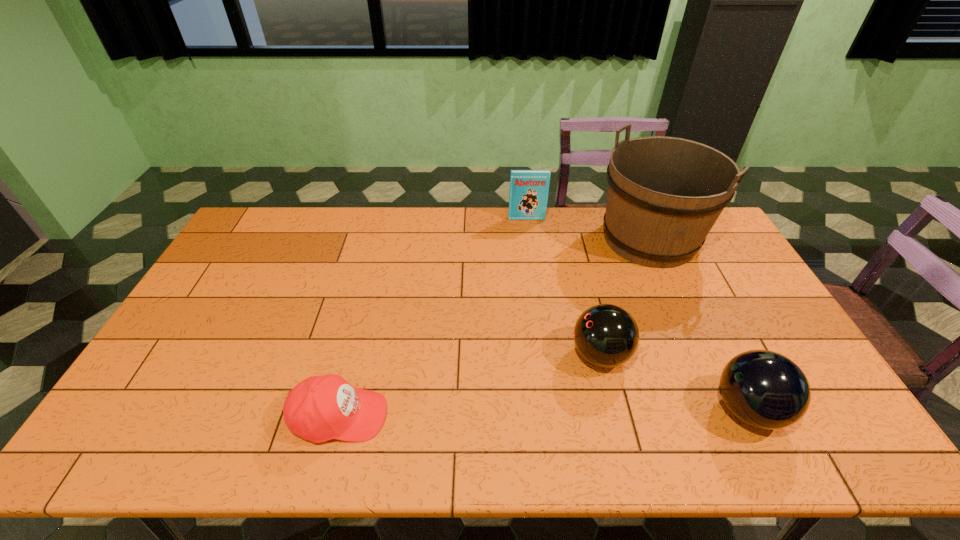
Where is `free space between the right bowling ball and the leftmost object`? The width and height of the screenshot is (960, 540). free space between the right bowling ball and the leftmost object is located at coordinates (543, 413).

Find the location of `vacant point located between the bucket and the book`. vacant point located between the bucket and the book is located at coordinates (588, 229).

At what (x,y) coordinates should I click in order to perform the action: click on empty space that is in between the book and the shortest object. Please return your answer as a coordinate pair (x, y). This screenshot has width=960, height=540. Looking at the image, I should click on (433, 318).

The width and height of the screenshot is (960, 540). I want to click on free space between the baseball cap and the left bowling ball, so click(x=469, y=386).

Find the location of a particular element. This screenshot has height=540, width=960. empty space between the book and the right bowling ball is located at coordinates (637, 314).

This screenshot has width=960, height=540. What are the coordinates of `free space between the tallest object and the left bowling ball` in the screenshot? It's located at (625, 297).

Identify the location of free area in between the leftmost object and the second object from left to right. (433, 318).

The width and height of the screenshot is (960, 540). Find the location of `unoccupied position between the leftmost object and the right bowling ball`. unoccupied position between the leftmost object and the right bowling ball is located at coordinates (x=543, y=413).

Identify the location of object that can be found as the closest to the left bowling ball. (764, 389).

Locate which object ranks in proximity to the baseball cap. Please provide its 2D coordinates. Your answer should be formatted as a tuple, i.e. [(x, y)], where the tuple contains the x and y coordinates of a point satisfying the conditions above.

[(606, 335)]